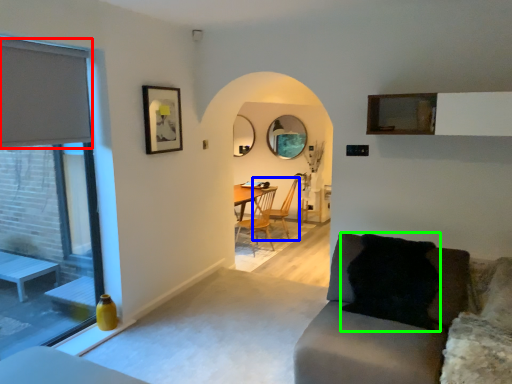
Question: Which object is positioned farthest from curtain (highlighted by a red box)? Select from chair (highlighted by a blue box) and pillow (highlighted by a green box).

Choices:
 (A) chair
 (B) pillow

Answer: (A)